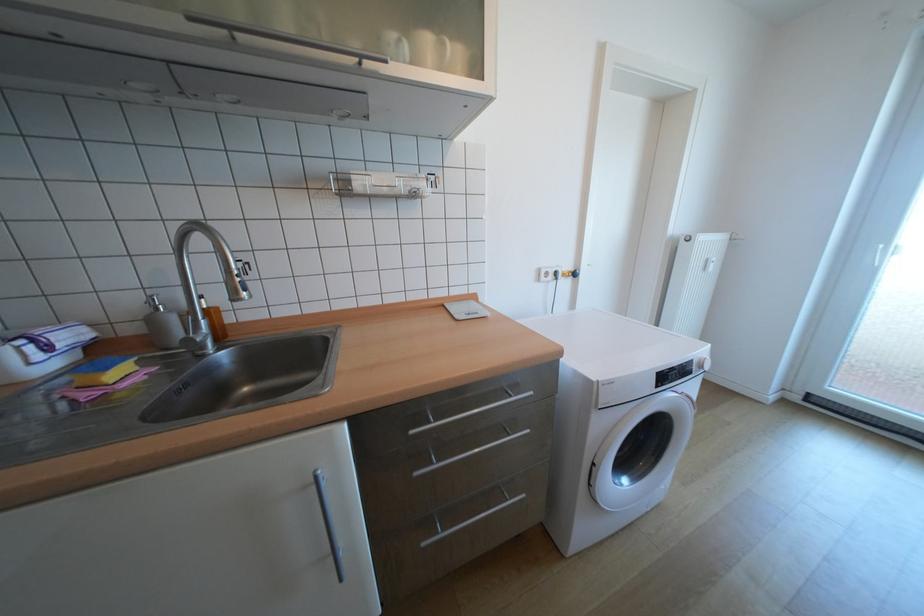
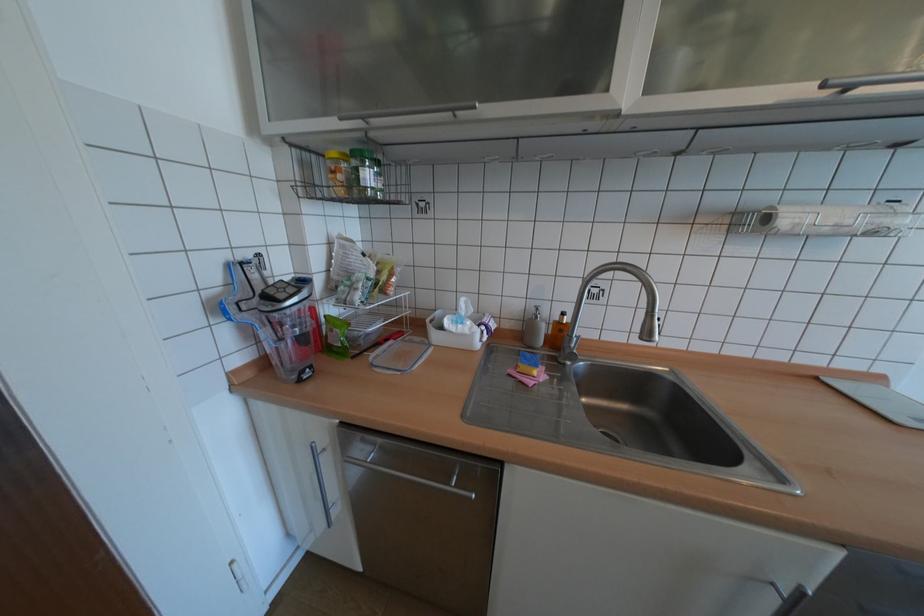
Where in the second image is the point corresponding to point 418,188 from the first image?

(881, 227)